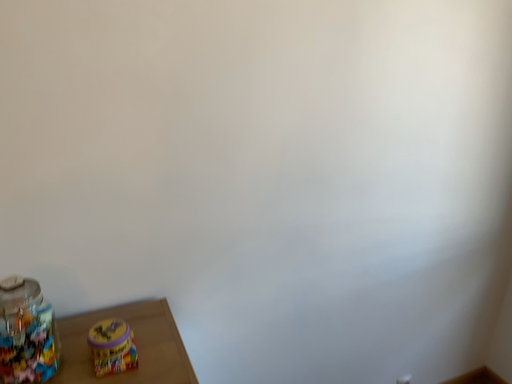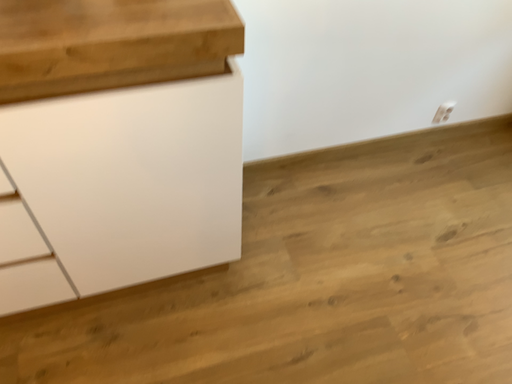
Question: How did the camera likely rotate when shooting the video?

Choices:
 (A) rotated downward
 (B) rotated upward

Answer: (A)